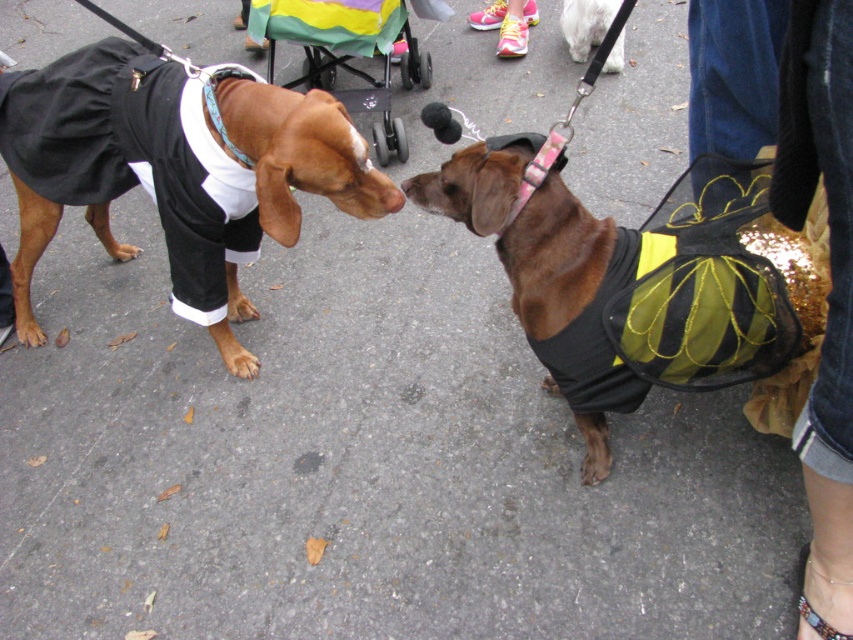
You are a dog owner trying to choose between the pink fabric sneakers at upper center and the pink fabric neckband at center for your dog. Which item would you recommend based on size?

The pink fabric sneakers at upper center are bigger than the pink fabric neckband at center, so the sneakers would be a better choice if you prioritize size.

You are standing on the street where the two dogs are playing. You notice two points marked in the scene. Which point is closer to you, point [567,227] or point [840,429]?

Point [567,227] is closer to you than point [840,429].